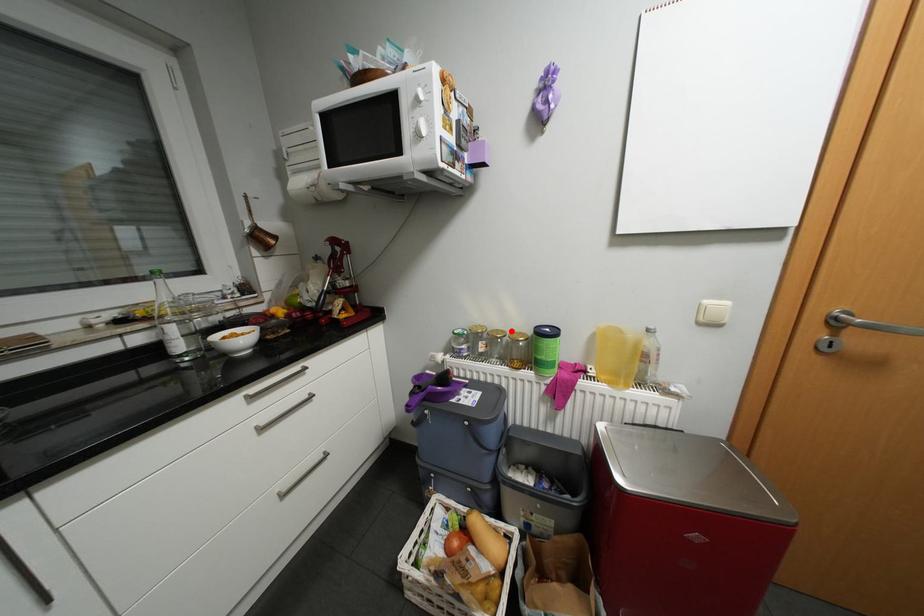
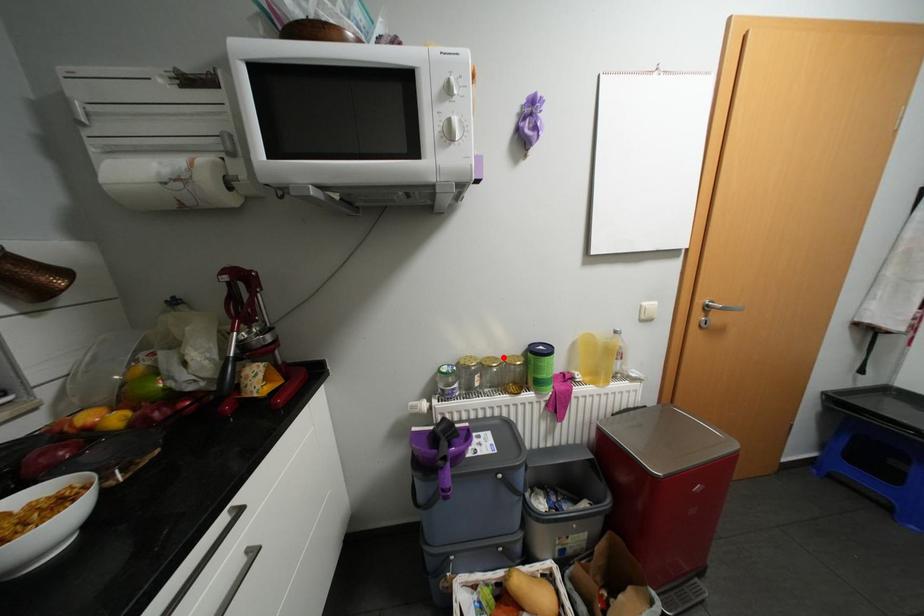
I am providing you with two images of the same scene from different viewpoints. A red point is marked on the first image and another point is marked on the second image. Do the highlighted points in image1 and image2 indicate the same real-world spot?

Yes